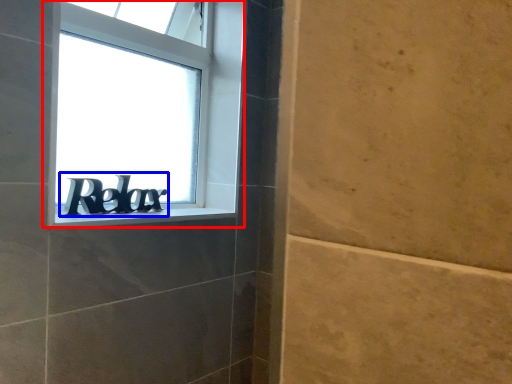
Question: Among these objects, which one is nearest to the camera, window (highlighted by a red box) or number (highlighted by a blue box)?

Choices:
 (A) window
 (B) number

Answer: (A)